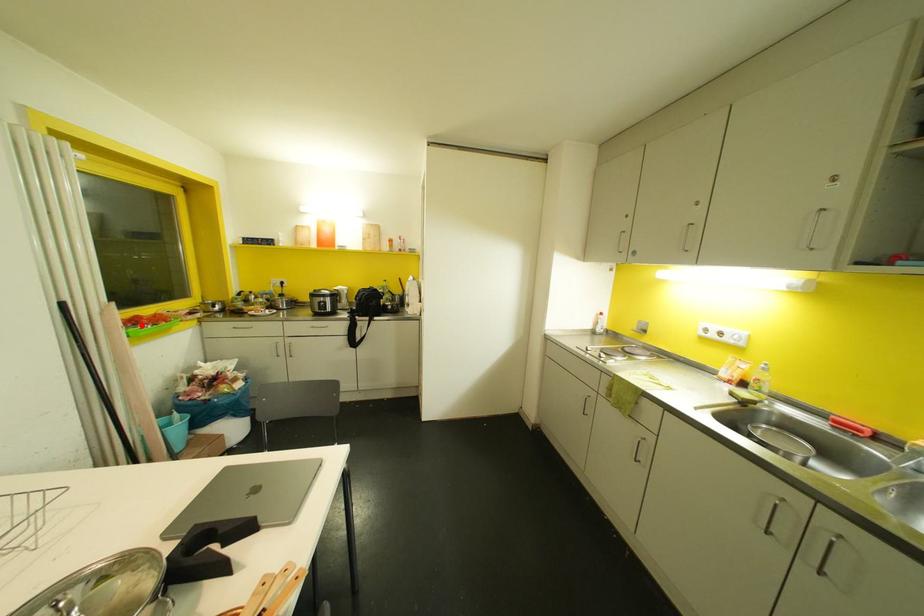
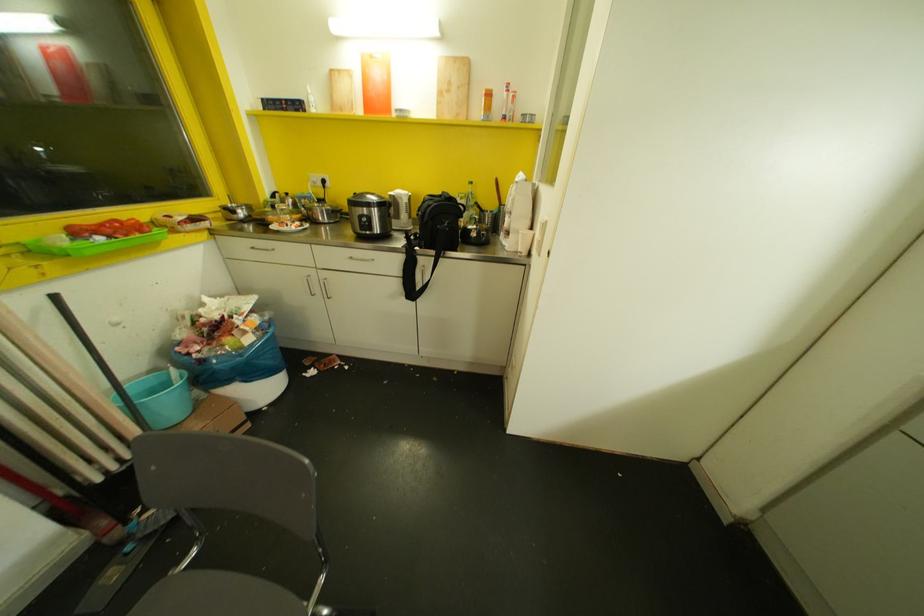
Find the pixel in the second image that matches the highlighted location in the first image.

(99, 237)